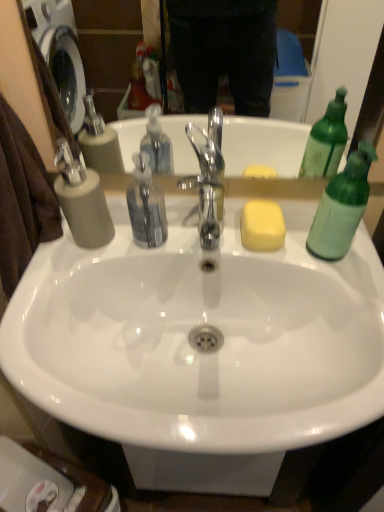
Describe the element at coordinates (195, 326) in the screenshot. I see `white glossy sink at center` at that location.

The height and width of the screenshot is (512, 384). Describe the element at coordinates (262, 226) in the screenshot. I see `yellow matte soap at center` at that location.

Locate an element on the screen. The width and height of the screenshot is (384, 512). white glossy sink at center is located at coordinates (x=195, y=326).

Is green translucent bottle at right facing towards yellow matte soap at center?

No, green translucent bottle at right does not turn towards yellow matte soap at center.

From a real-world perspective, which is physically above, green translucent bottle at right or yellow matte soap at center?

green translucent bottle at right.

Which is in front, point (364, 156) or point (279, 234)?

Point (364, 156)

I want to click on soap behind the green translucent bottle at right, so click(262, 226).

Which is less distant, (x=253, y=215) or (x=309, y=275)?

The point (x=309, y=275) is more forward.

From the image's perspective, is yellow matte soap at center under white glossy sink at center?

No, from the image's perspective, yellow matte soap at center is not below white glossy sink at center.

Can you tell me how much yellow matte soap at center and white glossy sink at center differ in facing direction?

They differ by 0.567 degrees in their facing directions.

Considering the relative sizes of yellow matte soap at center and white glossy sink at center in the image provided, is yellow matte soap at center wider than white glossy sink at center?

No.

Do you think matte gray soap dispenser at left is within white glossy sink at center, or outside of it?

matte gray soap dispenser at left is located beyond the bounds of white glossy sink at center.

Is white glossy sink at center at the back of matte gray soap dispenser at left?

No, white glossy sink at center is not at the back of matte gray soap dispenser at left.

From a real-world perspective, who is located lower, matte gray soap dispenser at left or white glossy sink at center?

In real-world perspective, white glossy sink at center is lower.

Does white glossy sink at center have a lesser height compared to green translucent bottle at right?

In fact, white glossy sink at center may be taller than green translucent bottle at right.

From a real-world perspective, is white glossy sink at center on green translucent bottle at right?

No.

Is white glossy sink at center positioned far away from green translucent bottle at right?

No.

What are the coordinates of `bottle above the white glossy sink at center (from the image's perspective)` in the screenshot? It's located at (342, 206).

What are the coordinates of `soap dispenser beneath the green translucent bottle at right (from a real-world perspective)` in the screenshot? It's located at (82, 200).

Is matte gray soap dispenser at left beside green translucent bottle at right?

matte gray soap dispenser at left and green translucent bottle at right are clearly separated.

Who is shorter, matte gray soap dispenser at left or green translucent bottle at right?

matte gray soap dispenser at left is shorter.

Which is more to the left, yellow matte soap at center or green translucent bottle at right?

yellow matte soap at center.

From the image's perspective, which is below, yellow matte soap at center or green translucent bottle at right?

yellow matte soap at center is shown below in the image.

In terms of width, does yellow matte soap at center look wider or thinner when compared to green translucent bottle at right?

Clearly, yellow matte soap at center has more width compared to green translucent bottle at right.

Based on their sizes in the image, would you say yellow matte soap at center is bigger or smaller than green translucent bottle at right?

yellow matte soap at center is smaller than green translucent bottle at right.

Considering the points (75, 186) and (261, 228), which point is behind, point (75, 186) or point (261, 228)?

Positioned behind is point (261, 228).

How many degrees apart are the facing directions of matte gray soap dispenser at left and yellow matte soap at center?

They differ by 0.00442 degrees in their facing directions.

Consider the image. Which object is wider, matte gray soap dispenser at left or yellow matte soap at center?

With larger width is yellow matte soap at center.

Is matte gray soap dispenser at left positioned far away from yellow matte soap at center?

No, there isn't a large distance between matte gray soap dispenser at left and yellow matte soap at center.

Locate an element on the screen. The height and width of the screenshot is (512, 384). soap lying behind the green translucent bottle at right is located at coordinates (262, 226).

The height and width of the screenshot is (512, 384). I want to click on sink in front of the yellow matte soap at center, so click(x=195, y=326).

Which object lies further to the anchor point matte gray soap dispenser at left, white glossy sink at center or yellow matte soap at center?

yellow matte soap at center lies further to matte gray soap dispenser at left than the other object.

Considering their positions, is green translucent bottle at right positioned closer to white glossy sink at center than matte gray soap dispenser at left?

matte gray soap dispenser at left lies closer to white glossy sink at center than the other object.

When comparing their distances from green translucent bottle at right, does white glossy sink at center or matte gray soap dispenser at left seem closer?

The object closer to green translucent bottle at right is white glossy sink at center.

Which object lies further to the anchor point white glossy sink at center, yellow matte soap at center or green translucent bottle at right?

Based on the image, green translucent bottle at right appears to be further to white glossy sink at center.

Based on the photo, when comparing their distances from yellow matte soap at center, does white glossy sink at center or green translucent bottle at right seem closer?

Among the two, green translucent bottle at right is located nearer to yellow matte soap at center.

In the scene shown: Based on their spatial positions, is yellow matte soap at center or matte gray soap dispenser at left further from white glossy sink at center?

matte gray soap dispenser at left is further to white glossy sink at center.

From the picture: From the image, which object appears to be nearer to green translucent bottle at right, white glossy sink at center or yellow matte soap at center?

yellow matte soap at center lies closer to green translucent bottle at right than the other object.

Estimate the real-world distances between objects in this image. Which object is closer to green translucent bottle at right, matte gray soap dispenser at left or yellow matte soap at center?

The object closer to green translucent bottle at right is yellow matte soap at center.

The height and width of the screenshot is (512, 384). Find the location of `sink situated between matte gray soap dispenser at left and yellow matte soap at center from left to right`. sink situated between matte gray soap dispenser at left and yellow matte soap at center from left to right is located at coordinates (195, 326).

This screenshot has width=384, height=512. What are the coordinates of `soap between matte gray soap dispenser at left and green translucent bottle at right from left to right` in the screenshot? It's located at (262, 226).

The image size is (384, 512). In order to click on sink between matte gray soap dispenser at left and green translucent bottle at right in the horizontal direction in this screenshot , I will do `click(195, 326)`.

The image size is (384, 512). Identify the location of soap between green translucent bottle at right and white glossy sink at center from top to bottom. (262, 226).